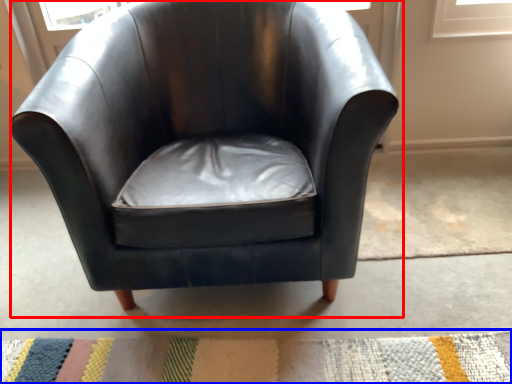
Question: Which of the following is the farthest to the observer, chair (highlighted by a red box) or doormat (highlighted by a blue box)?

Choices:
 (A) chair
 (B) doormat

Answer: (B)